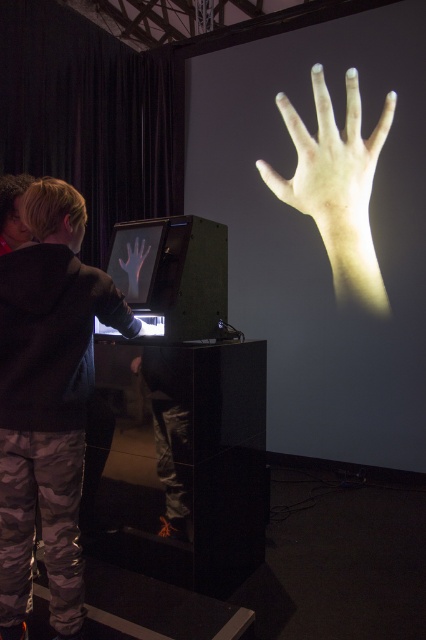
Based on the scene description, can you determine the spatial relationship between the light beige skin at upper center and the matte black hand at center?

The light beige skin at upper center is positioned above the matte black hand at center.

You are an art curator planning to install a new exhibit. The exhibit requires a sensor that must be placed exactly at the coordinates where the camouflage pants at lower left are located. What are the coordinates for placing the sensor?

The coordinates for placing the sensor should be at point (48, 401), as specified by the position of the camouflage pants at lower left.

You are an event coordinator planning to set up a photo booth in this space. You need to ensure that the camouflage pants at lower left and the light beige skin at upper center are both visible in the booth photos. Based on their positions, which object should be placed closer to the camera to ensure both are in focus?

The camouflage pants at lower left should be placed closer to the camera because it is located below the light beige skin at upper center, so adjusting their distance can help both be in focus.